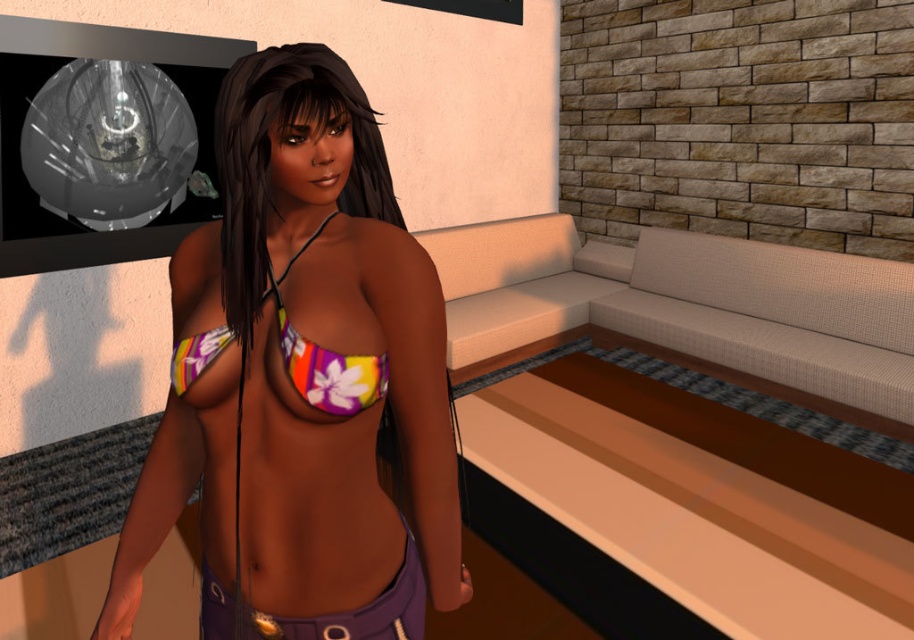
You are designing a poster for a beachwear brand and need to arrange two bikinis from the image. The floral fabric bikini top at center and the multicolored fabric bikini top at center. Which one should be placed higher on the poster to maintain the same vertical positioning as in the original image?

The floral fabric bikini top at center should be placed higher on the poster since it is taller than the multicolored fabric bikini top at center in the original image.